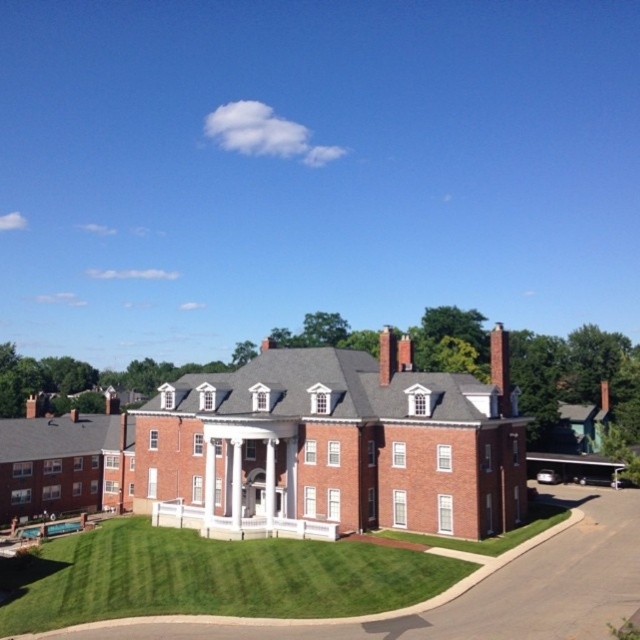
Question: Among these objects, which one is farthest from the camera?

Choices:
 (A) red brick chimney at center
 (B) green grass at lower center
 (C) brick house at center

Answer: (A)

Question: Which is nearer to the green grass at lower center?

Choices:
 (A) red brick chimney at upper center
 (B) red brick chimney at center

Answer: (B)

Question: Is green grass at lower center positioned at the back of red brick chimney at center?

Choices:
 (A) yes
 (B) no

Answer: (B)

Question: Is green grass at lower center smaller than red brick chimney at center?

Choices:
 (A) no
 (B) yes

Answer: (A)

Question: Which point is farther to the camera?

Choices:
 (A) (54, 493)
 (B) (497, 349)
 (C) (388, 326)

Answer: (C)

Question: Is brick mansion at lower left above green grass at lower center?

Choices:
 (A) yes
 (B) no

Answer: (A)